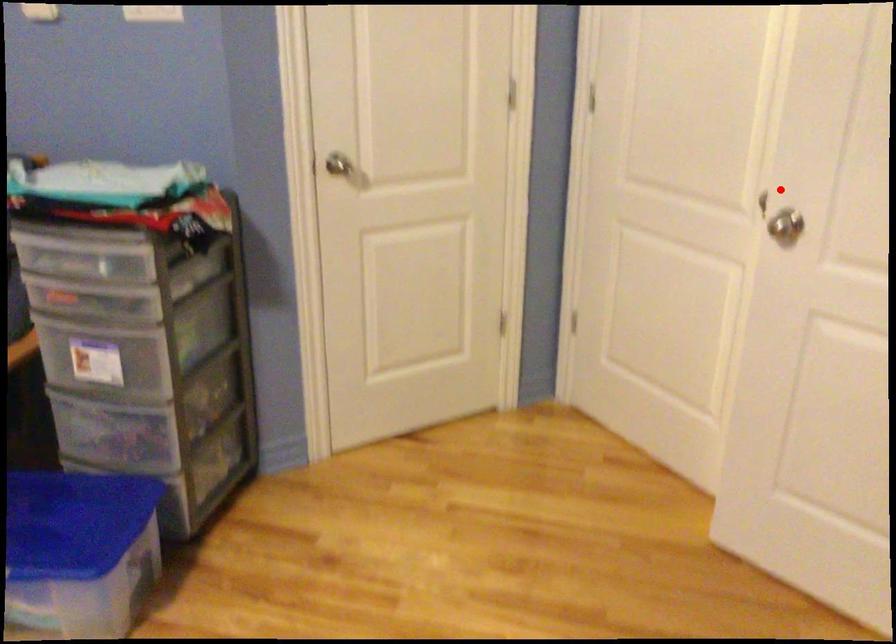
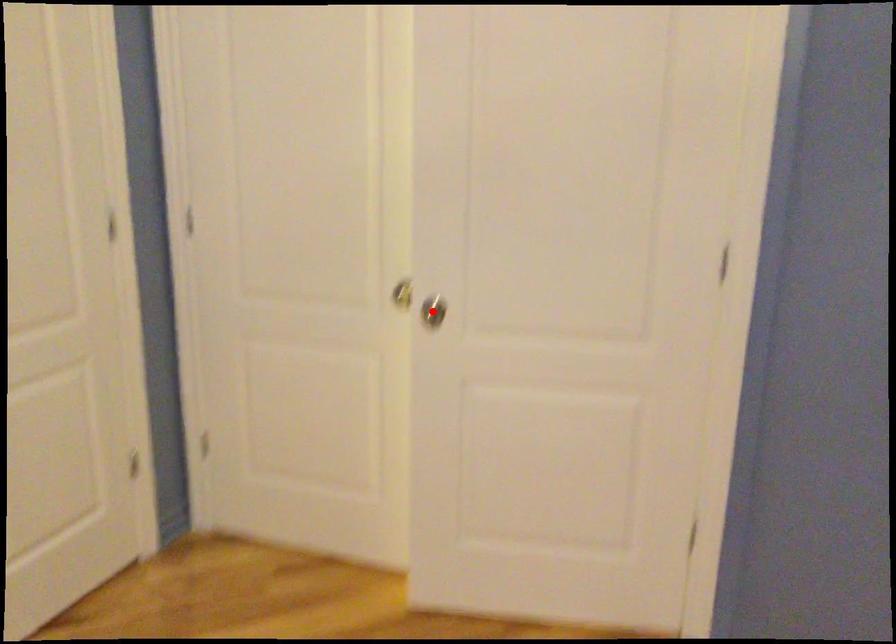
I am providing you with two images of the same scene from different viewpoints. A red point is marked on the first image and another point is marked on the second image. Is the red point in image1 aligned with the point shown in image2?

No